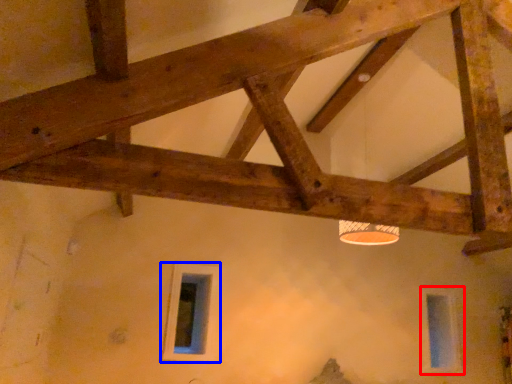
Question: Which object is further to the camera taking this photo, window (highlighted by a red box) or window (highlighted by a blue box)?

Choices:
 (A) window
 (B) window

Answer: (A)